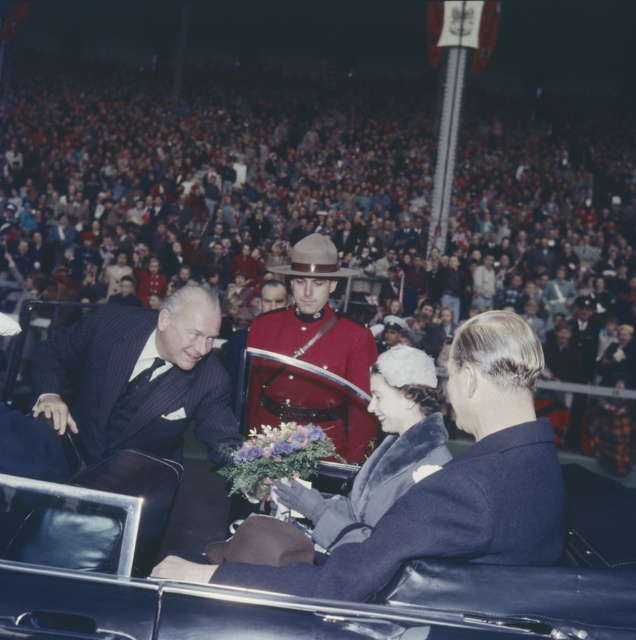
Is dark blue pinstripe suit at center positioned at the back of purple silk bouquet at center?

Yes, dark blue pinstripe suit at center is further from the viewer.

In the scene shown: Who is lower down, dark blue pinstripe suit at center or purple silk bouquet at center?

Positioned lower is purple silk bouquet at center.

What do you see at coordinates (139, 378) in the screenshot? Image resolution: width=636 pixels, height=640 pixels. I see `dark blue pinstripe suit at center` at bounding box center [139, 378].

Where is `dark blue pinstripe suit at center`? This screenshot has width=636, height=640. dark blue pinstripe suit at center is located at coordinates (139, 378).

Is multicolored fabric crowd at upper center to the left of velvet gray coat at center from the viewer's perspective?

Indeed, multicolored fabric crowd at upper center is positioned on the left side of velvet gray coat at center.

Measure the distance between point (x=223, y=268) and camera.

The distance of point (x=223, y=268) from camera is 13.80 meters.

Identify the location of multicolored fabric crowd at upper center. (305, 209).

Is multicolored fabric crowd at upper center thinner than dark blue pinstripe suit at center?

No.

Is multicolored fabric crowd at upper center positioned in front of dark blue pinstripe suit at center?

That is False.

Between point (95, 195) and point (59, 333), which one is positioned in front?

Point (59, 333) is in front.

This screenshot has width=636, height=640. I want to click on multicolored fabric crowd at upper center, so click(305, 209).